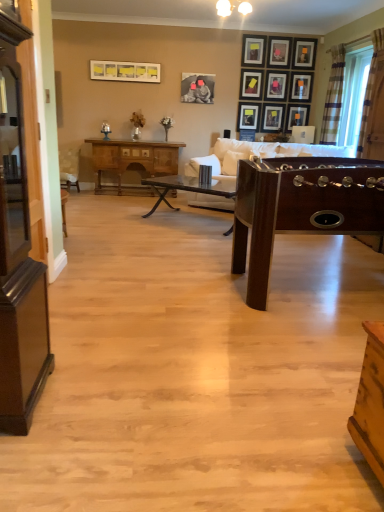
Where is `vacant area that lies to the right of shiny dark wood cabinet at left`? This screenshot has height=512, width=384. vacant area that lies to the right of shiny dark wood cabinet at left is located at coordinates (93, 406).